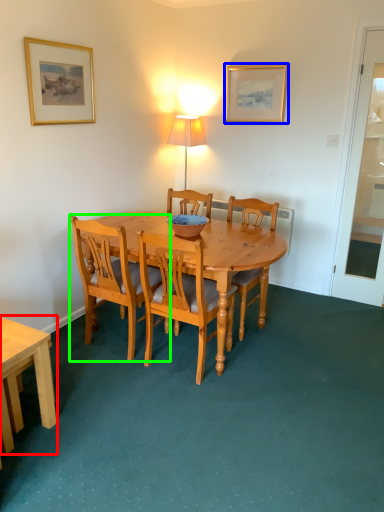
Question: Based on their relative distances, which object is farther from desk (highlighted by a red box)? Choose from picture frame (highlighted by a blue box) and chair (highlighted by a green box).

Choices:
 (A) picture frame
 (B) chair

Answer: (A)